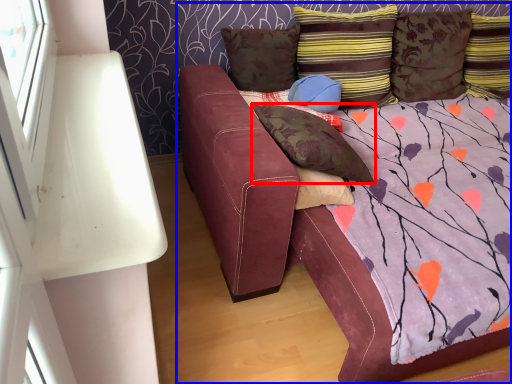
Question: Which of the following is the closest to the observer, pillow (highlighted by a red box) or studio couch (highlighted by a blue box)?

Choices:
 (A) pillow
 (B) studio couch

Answer: (B)